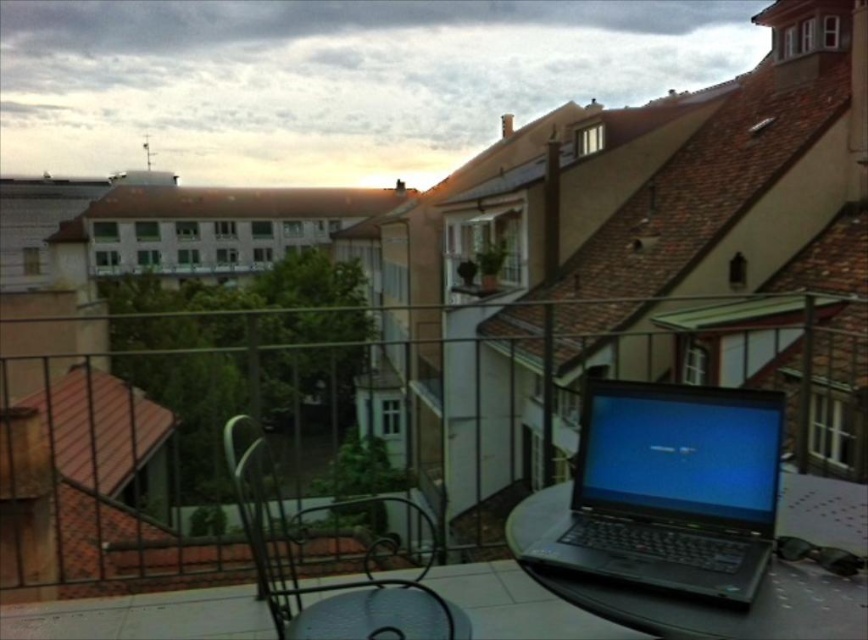
You are organizing a small event on the rooftop and need to place a rectangular tablecloth that is 1.2 meters wide on the table where the black matte laptop at center and black wrought iron chair at center are located. Can the tablecloth fit over the table without hanging off the edges?

The black matte laptop at center is narrower than the black wrought iron chair at center, but the tablecloth width of 1.2 meters must be compared to the table itself. However, the description only provides the relative width between the two objects, not the table dimensions. Therefore, it is impossible to determine if the tablecloth will fit without additional information about the table size.

You are a photographer setting up a tripod to capture the rooftop scene. The camera is placed at the edge of the balcony. You need to ensure that the black matte laptop at center is within the camera frame. Given that the camera has a 50mm lens with a field of view of approximately 46 degrees, will the laptop fit in the frame if the camera is positioned 1.64 meters away from it?

The black matte laptop at center and camera are 1.64 meters apart. Since the camera is positioned exactly at this distance, and the field of view of a 50mm lens is about 46 degrees, the laptop should fit within the frame as the distance aligns with the lens specifications.